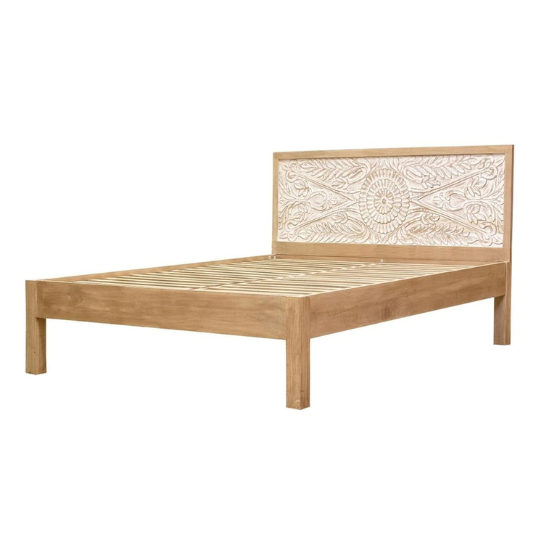
Where is `empty space between bed frame`? The height and width of the screenshot is (544, 544). empty space between bed frame is located at coordinates (374, 345).